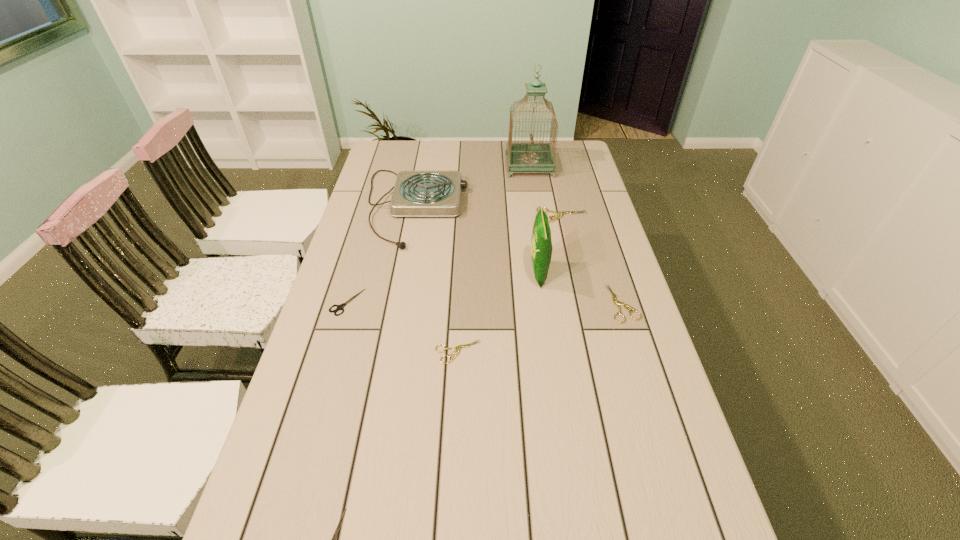
This screenshot has height=540, width=960. I want to click on birdcage, so click(x=531, y=157).

What are the coordinates of `the tallest object` in the screenshot? It's located at (531, 157).

The image size is (960, 540). In order to click on crisp (potato chip) in this screenshot , I will do `click(541, 245)`.

Image resolution: width=960 pixels, height=540 pixels. In order to click on green crisp (potato chip) in this screenshot , I will do `click(541, 245)`.

Identify the location of hotplate. The width and height of the screenshot is (960, 540). (416, 193).

At what (x,y) coordinates should I click in order to perform the action: click on the biggest beige shears. Please return your answer as a coordinate pair (x, y). Image resolution: width=960 pixels, height=540 pixels. Looking at the image, I should click on (559, 214).

I want to click on the farthest shears, so click(559, 214).

This screenshot has height=540, width=960. Find the location of `the leftmost shears`. the leftmost shears is located at coordinates (339, 307).

I want to click on the left black shears, so click(x=339, y=307).

Locate an element on the screen. Image resolution: width=960 pixels, height=540 pixels. the second nearest beige shears is located at coordinates pos(616,302).